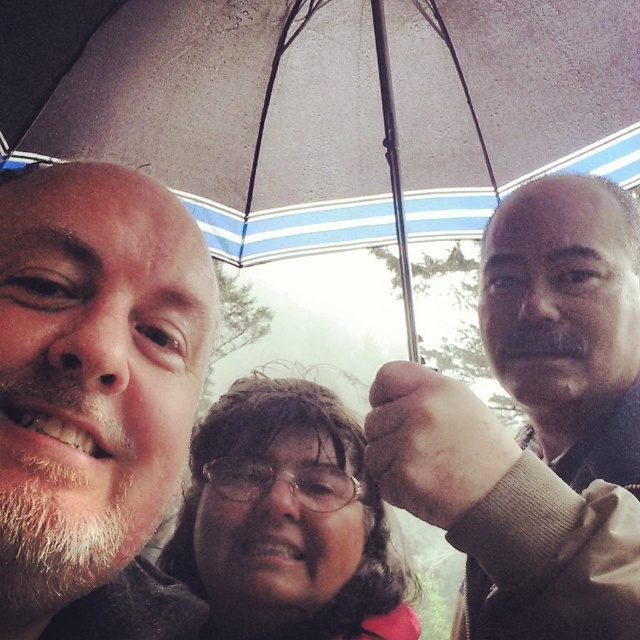
Looking at this image, you are standing in a rainstorm and need to take a photo of the transparent fabric umbrella at upper center. Where should you position yourself to capture the umbrella in the frame?

The transparent fabric umbrella at upper center is located at point 0.169 on the horizontal axis and 0.512 on the vertical axis, so you should position yourself slightly to the left and center to ensure the umbrella is in the frame.